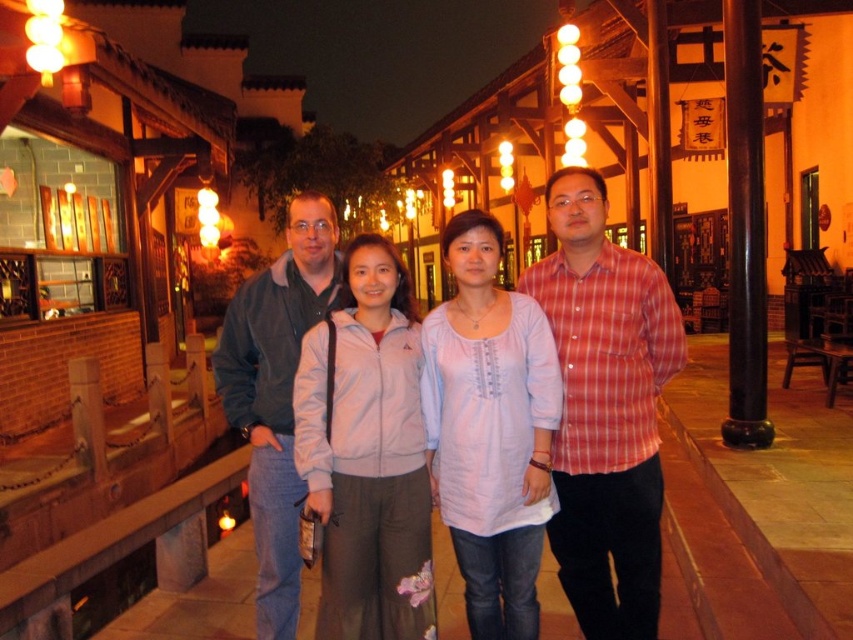
Does light pink cotton blouse at center have a larger size compared to velvet blue jacket at center?

No.

This screenshot has width=853, height=640. I want to click on light pink cotton blouse at center, so click(x=490, y=429).

Between point (521, 540) and point (285, 604), which one is positioned behind?

Point (285, 604)

Identify the location of light pink cotton blouse at center. (490, 429).

Is red plaid shirt at center smaller than light pink fabric at center?

No.

Which is more to the right, red plaid shirt at center or light pink fabric at center?

From the viewer's perspective, red plaid shirt at center appears more on the right side.

Is point (599, 467) positioned in front of point (408, 579)?

No.

Where is `red plaid shirt at center`? This screenshot has width=853, height=640. red plaid shirt at center is located at coordinates (605, 408).

Which is below, matte gray jacket at center or velvet blue jacket at center?

velvet blue jacket at center is below.

Which is behind, point (616, 412) or point (279, 612)?

The point (279, 612) is behind.

Between point (611, 316) and point (289, 452), which one is positioned in front?

Positioned in front is point (611, 316).

Identify the location of matte gray jacket at center. (605, 410).